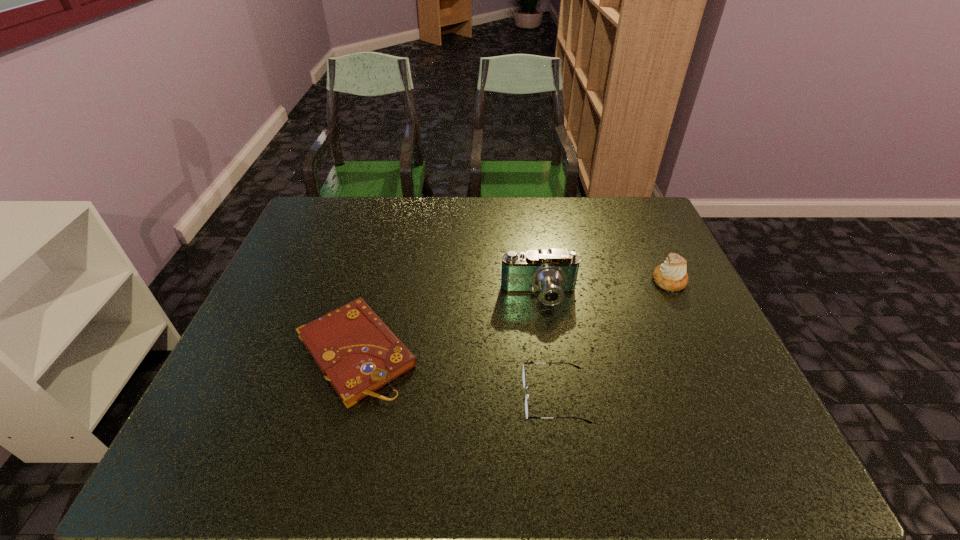
At what (x,y) coordinates should I click in order to perform the action: click on vacant position located on the back of the leftmost object. Please return your answer as a coordinate pair (x, y). Image resolution: width=960 pixels, height=540 pixels. Looking at the image, I should click on (375, 280).

Find the location of a particular element. This screenshot has height=540, width=960. object located at the left edge is located at coordinates (354, 349).

Identify the location of object that is positioned at the right edge. click(671, 276).

In the image, there is a desktop. Where is `vacant area at the far edge`? This screenshot has height=540, width=960. vacant area at the far edge is located at coordinates click(406, 204).

This screenshot has width=960, height=540. In order to click on free location at the near edge in this screenshot , I will do `click(385, 466)`.

The width and height of the screenshot is (960, 540). Find the location of `vacant space at the left edge`. vacant space at the left edge is located at coordinates coord(325,259).

You are a GUI agent. You are given a task and a screenshot of the screen. Output one action in this format:
    pyautogui.click(x=<x>, y=<y>)
    Task: Click on the vacant space at the right edge of the desktop
    
    Given the screenshot: What is the action you would take?
    pyautogui.click(x=648, y=297)

Image resolution: width=960 pixels, height=540 pixels. Identify the location of free space at the far left corner of the desktop. (318, 221).

The width and height of the screenshot is (960, 540). I want to click on free spot between the notebook and the tallest object, so click(x=447, y=324).

Find the location of a particular element. free area in between the spectacles and the notebook is located at coordinates (455, 375).